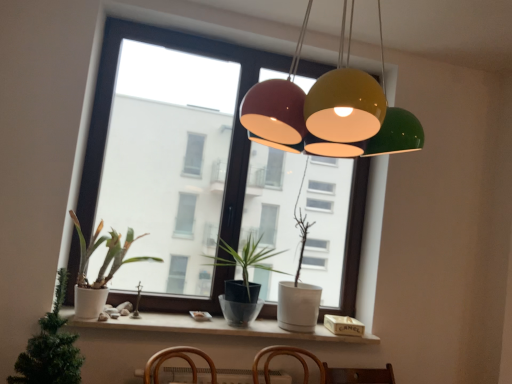
Question: Considering the relative sizes of white matte pot at left, which is the 1th houseplant in front-to-back order, and white matte pot at left, acting as the 2th houseplant starting from the back, in the image provided, is white matte pot at left, which is the 1th houseplant in front-to-back order, shorter than white matte pot at left, acting as the 2th houseplant starting from the back,?

Choices:
 (A) yes
 (B) no

Answer: (B)

Question: Considering the relative positions of white matte pot at left, which is the third houseplant in back-to-front order, and white matte pot at left, the 2th houseplant positioned from the front, in the image provided, is white matte pot at left, which is the third houseplant in back-to-front order, behind white matte pot at left, the 2th houseplant positioned from the front,?

Choices:
 (A) no
 (B) yes

Answer: (A)

Question: Can you confirm if white matte pot at left, which is the 1th houseplant in front-to-back order, is taller than white matte pot at left, the 2th houseplant positioned from the front?

Choices:
 (A) yes
 (B) no

Answer: (A)

Question: Can you confirm if white matte pot at left, which is the 1th houseplant in front-to-back order, is thinner than white matte pot at left, the 2th houseplant positioned from the front?

Choices:
 (A) yes
 (B) no

Answer: (B)

Question: Does white matte pot at left, which is the 1th houseplant in front-to-back order, appear on the left side of white matte pot at left, acting as the 2th houseplant starting from the back?

Choices:
 (A) yes
 (B) no

Answer: (A)

Question: Does white matte pot at left, which is the third houseplant in back-to-front order, have a greater width compared to white matte pot at left, the 2th houseplant positioned from the front?

Choices:
 (A) no
 (B) yes

Answer: (B)

Question: Considering the relative sizes of matte black pot at center, the third houseplant from the front, and white matte window sill at lower center in the image provided, is matte black pot at center, the third houseplant from the front, taller than white matte window sill at lower center?

Choices:
 (A) yes
 (B) no

Answer: (A)

Question: Can you confirm if matte black pot at center, the third houseplant from the front, is positioned to the left of white matte window sill at lower center?

Choices:
 (A) no
 (B) yes

Answer: (A)

Question: From a real-world perspective, is matte black pot at center, the third houseplant from the front, on top of white matte window sill at lower center?

Choices:
 (A) yes
 (B) no

Answer: (A)

Question: From the image's perspective, is matte black pot at center, the third houseplant from the front, above white matte window sill at lower center?

Choices:
 (A) no
 (B) yes

Answer: (B)

Question: Is matte black pot at center, the third houseplant from the front, further to camera compared to white matte window sill at lower center?

Choices:
 (A) no
 (B) yes

Answer: (B)

Question: Considering the relative sizes of matte black pot at center, the third houseplant from the front, and white matte window sill at lower center in the image provided, is matte black pot at center, the third houseplant from the front, smaller than white matte window sill at lower center?

Choices:
 (A) no
 (B) yes

Answer: (A)

Question: Does transparent glass window at center have a greater width compared to white matte pot at left, acting as the 2th houseplant starting from the back?

Choices:
 (A) yes
 (B) no

Answer: (B)